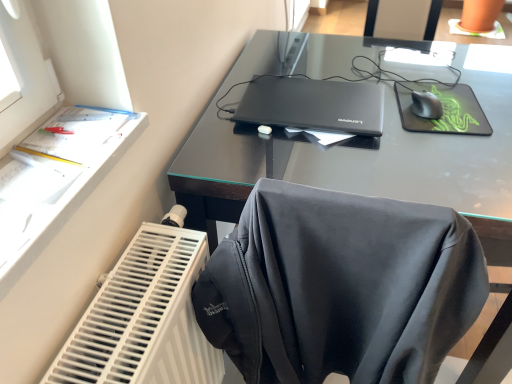
I want to click on vacant region to the left of green matte mousepad at upper right, so [389, 113].